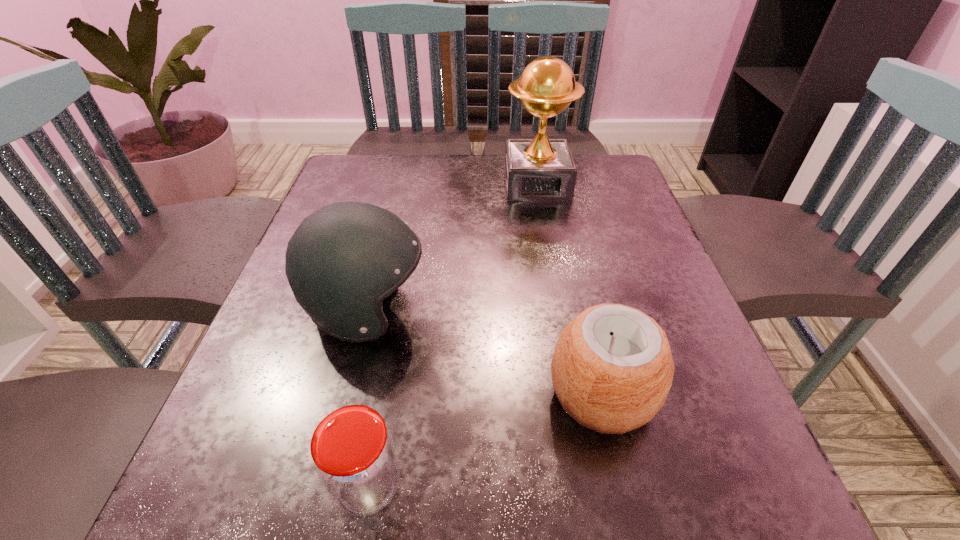
Find the location of a particular element. The height and width of the screenshot is (540, 960). free spot that satisfies the following two spatial constraints: 1. on the front-facing side of the farthest object; 2. at the face opening of the football helmet is located at coordinates (560, 309).

This screenshot has height=540, width=960. Identify the location of vacant space that satisfies the following two spatial constraints: 1. at the face opening of the nearest object; 2. on the right side of the football helmet. click(323, 485).

You are a GUI agent. You are given a task and a screenshot of the screen. Output one action in this format:
    pyautogui.click(x=<x>, y=<y>)
    Task: Click on the vacant region that satisfies the following two spatial constraints: 1. on the back side of the jar; 2. at the face opening of the football helmet
    
    Given the screenshot: What is the action you would take?
    pyautogui.click(x=399, y=309)